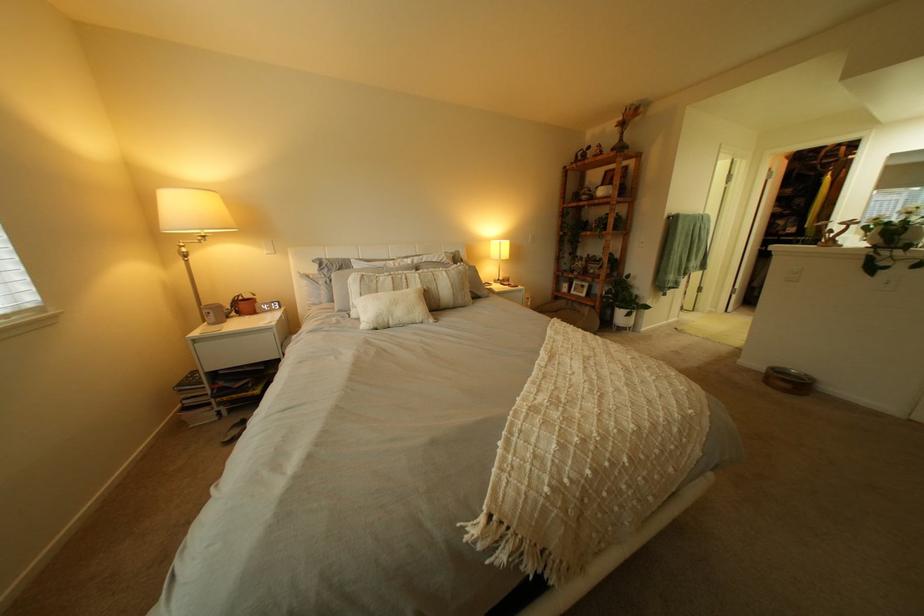
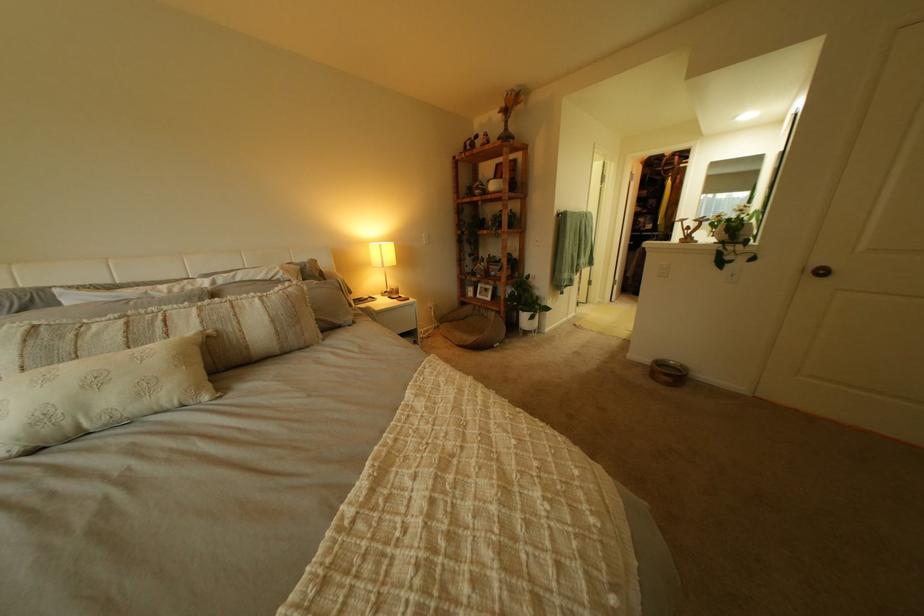
In the second image, find the point that corresponds to (x=779, y=369) in the first image.

(663, 362)